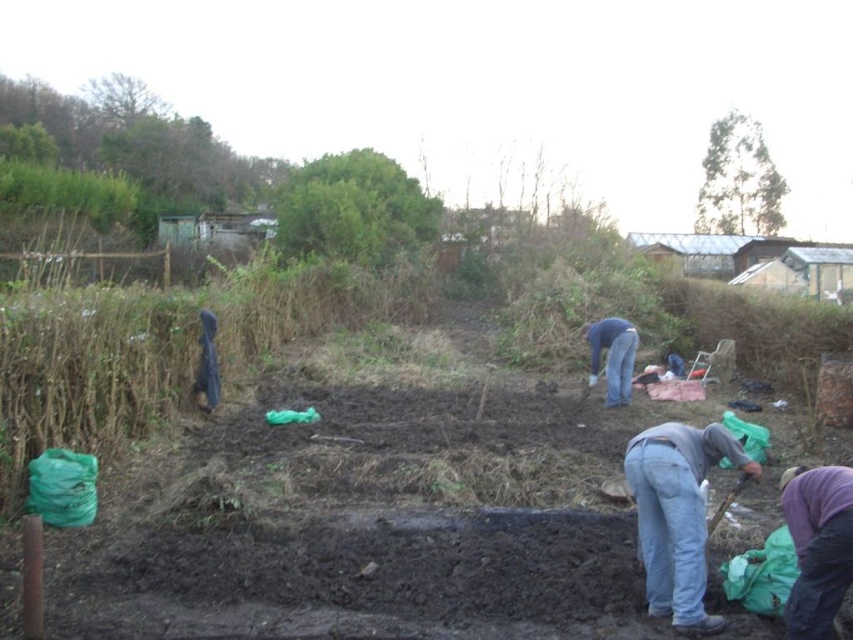
Question: Based on their relative distances, which object is farther from the purple fabric at lower right?

Choices:
 (A) blue jeans at center
 (B) wooden handle shovel at lower right
 (C) gray cotton shirt at lower right

Answer: (A)

Question: Does gray cotton shirt at lower right appear under purple fabric at lower right?

Choices:
 (A) no
 (B) yes

Answer: (A)

Question: Which of the following is the farthest from the observer?

Choices:
 (A) purple fabric at lower right
 (B) gray cotton shirt at lower right
 (C) wooden handle shovel at lower right
 (D) blue jeans at center

Answer: (D)

Question: Which object is closer to the camera taking this photo?

Choices:
 (A) wooden handle shovel at lower right
 (B) purple fabric at lower right
 (C) blue jeans at center
 (D) gray cotton shirt at lower right

Answer: (B)

Question: Can you confirm if blue jeans at center is positioned below wooden handle shovel at lower right?

Choices:
 (A) no
 (B) yes

Answer: (A)

Question: Does gray cotton shirt at lower right have a lesser width compared to wooden handle shovel at lower right?

Choices:
 (A) no
 (B) yes

Answer: (A)